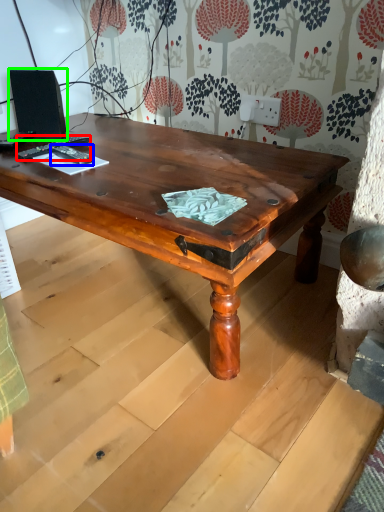
Question: Based on their relative distances, which object is nearer to remote control (highlighted by a red box)? Choose from remote control (highlighted by a blue box) and speaker (highlighted by a green box).

Choices:
 (A) remote control
 (B) speaker

Answer: (A)